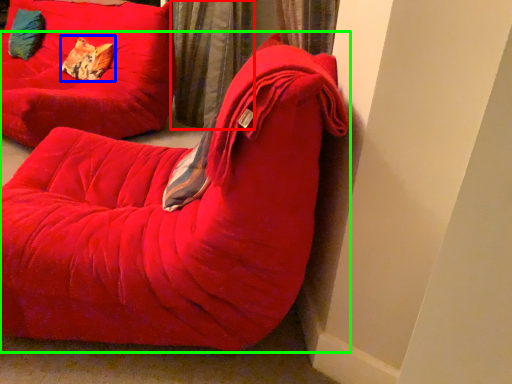
Question: Based on their relative distances, which object is nearer to curtain (highlighted by a red box)? Choose from pillow (highlighted by a blue box) and furniture (highlighted by a green box).

Choices:
 (A) pillow
 (B) furniture

Answer: (A)